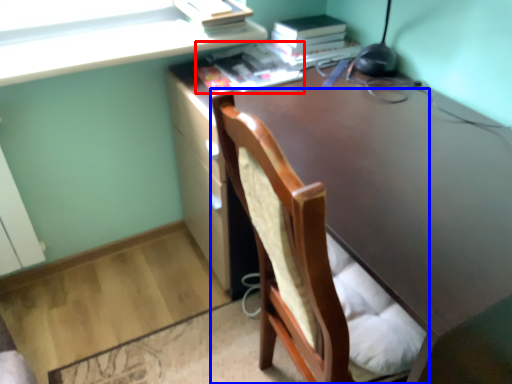
Question: Which of the following is the closest to the observer, book (highlighted by a red box) or chair (highlighted by a blue box)?

Choices:
 (A) book
 (B) chair

Answer: (B)